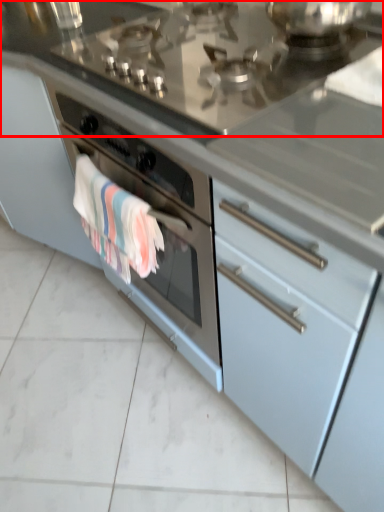
Question: From the image, what is the correct spatial relationship of countertop (annotated by the red box) in relation to bath towel?

Choices:
 (A) left
 (B) right

Answer: (B)